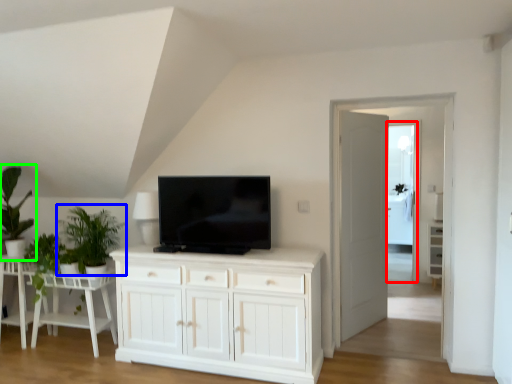
Question: Which object is the farthest from glass door (highlighted by a red box)? Choose among these: plant (highlighted by a blue box) or houseplant (highlighted by a green box).

Choices:
 (A) plant
 (B) houseplant

Answer: (B)